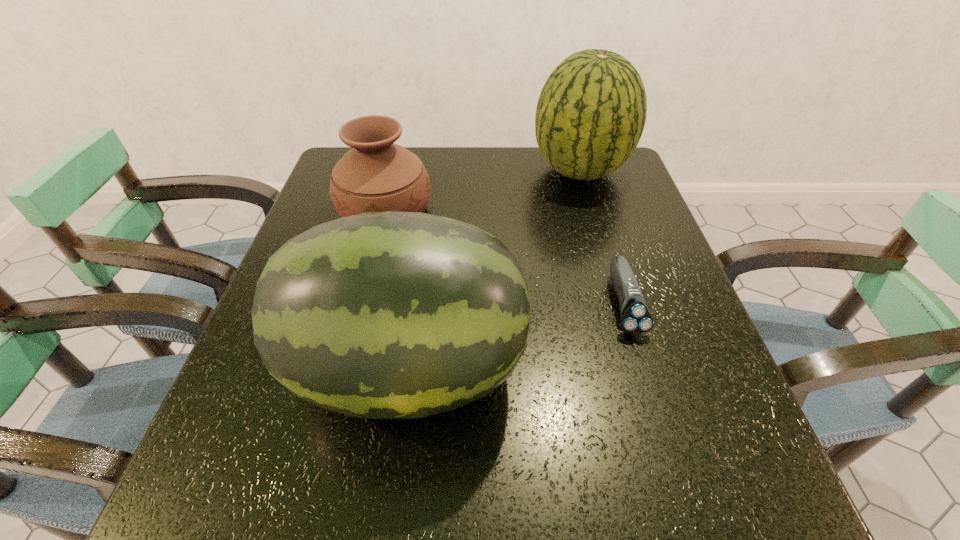
This screenshot has height=540, width=960. Find the location of `vacant region at the far right corner of the desktop`. vacant region at the far right corner of the desktop is located at coordinates (630, 176).

The image size is (960, 540). I want to click on empty space between the right watermelon and the urn, so click(x=483, y=191).

Locate an element on the screen. empty location between the farther watermelon and the shortest object is located at coordinates (602, 237).

Select which object appears as the closest to the urn. Please provide its 2D coordinates. Your answer should be formatted as a tuple, i.e. [(x, y)], where the tuple contains the x and y coordinates of a point satisfying the conditions above.

[(383, 315)]

You are a GUI agent. You are given a task and a screenshot of the screen. Output one action in this format:
    pyautogui.click(x=<x>, y=<y>)
    Task: Click on the object identified as the third closest to the urn
    
    Given the screenshot: What is the action you would take?
    pyautogui.click(x=635, y=318)

Find the location of `vacant point that satisfies the following two spatial constraints: 1. on the front side of the nearer watermelon; 2. on the right side of the second shortest object`. vacant point that satisfies the following two spatial constraints: 1. on the front side of the nearer watermelon; 2. on the right side of the second shortest object is located at coordinates (345, 369).